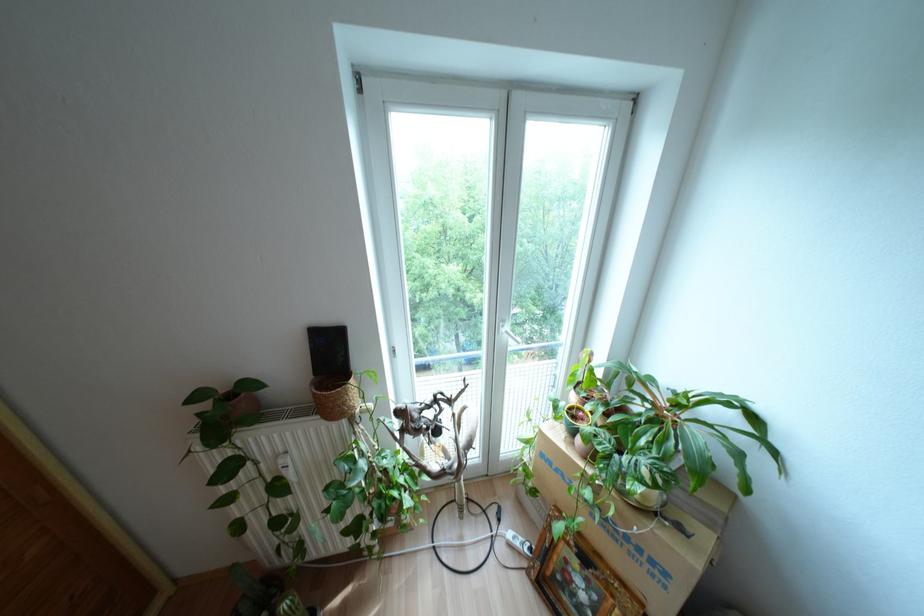
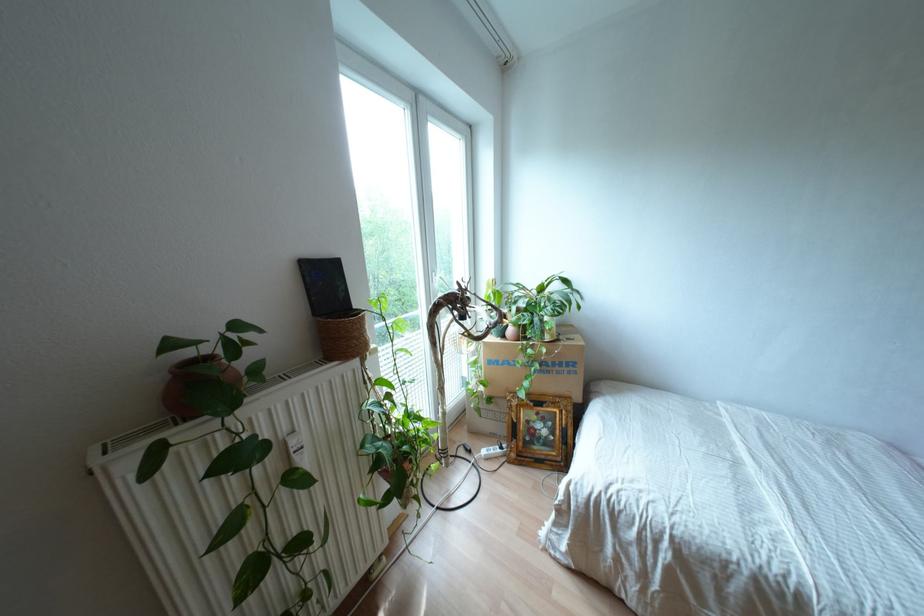
Where in the second image is the point corresponding to (x=638, y=549) from the first image?

(560, 363)